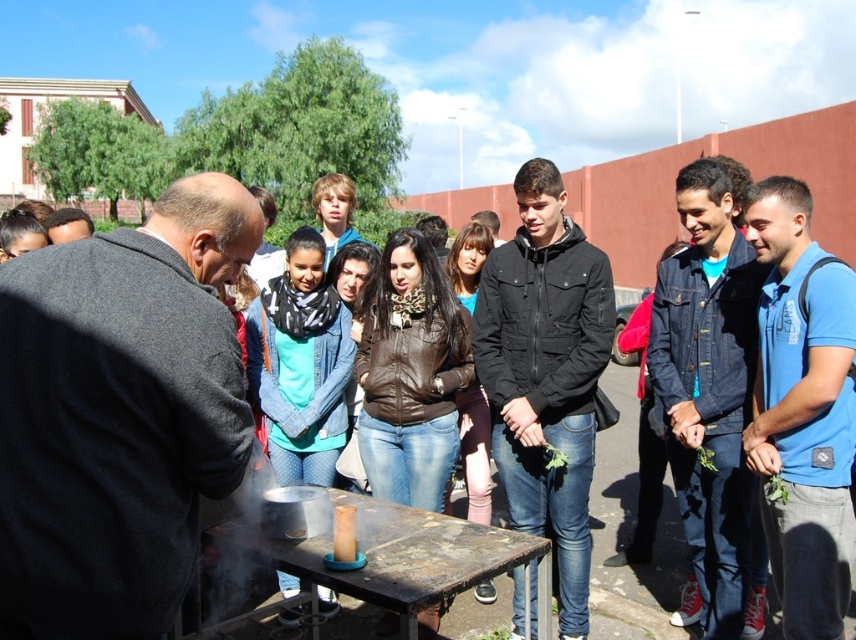
Question: Which object appears closest to the camera in this image?

Choices:
 (A) black leather jacket at center
 (B) teal jersey at center
 (C) blue cotton polo shirt at center right
 (D) translucent glass jar at center

Answer: (D)

Question: Is teal jersey at center bigger than brown leather jacket at center?

Choices:
 (A) no
 (B) yes

Answer: (B)

Question: Is blue cotton polo shirt at center right above teal jersey at center?

Choices:
 (A) no
 (B) yes

Answer: (A)

Question: Among these points, which one is farthest from the camera?

Choices:
 (A) (591, 300)
 (B) (331, 557)
 (C) (486, 445)

Answer: (C)

Question: Among these objects, which one is nearest to the camera?

Choices:
 (A) rusty metal table at center
 (B) brown leather jacket at center
 (C) denim jacket at center

Answer: (A)

Question: Considering the relative positions of denim jacket at center and teal jersey at center in the image provided, where is denim jacket at center located with respect to teal jersey at center?

Choices:
 (A) right
 (B) left

Answer: (A)